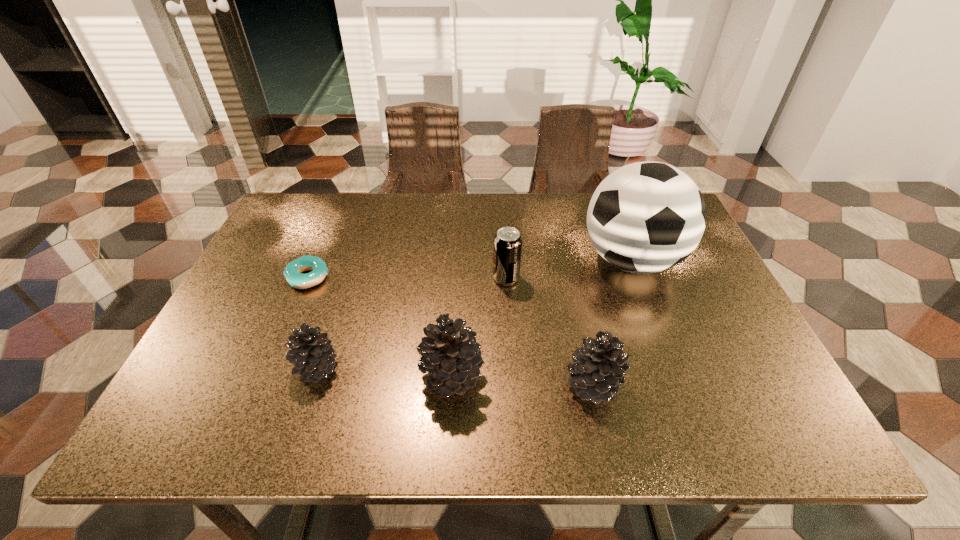
Where is `the leftmost pinecone`? The width and height of the screenshot is (960, 540). the leftmost pinecone is located at coordinates (312, 352).

Identify the location of the shortest pinecone. The image size is (960, 540). (312, 352).

Locate an element on the screen. The image size is (960, 540). the fourth object from right to left is located at coordinates (450, 353).

The image size is (960, 540). In order to click on the rightmost pinecone in this screenshot , I will do `click(598, 373)`.

This screenshot has height=540, width=960. What are the coordinates of `the tallest object` in the screenshot? It's located at (646, 217).

Identify the location of doughnut. (292, 272).

The height and width of the screenshot is (540, 960). What are the coordinates of `soda can` in the screenshot? It's located at (507, 248).

Where is `vacant space positioned 0.220m on the back of the fifth tallest object`? vacant space positioned 0.220m on the back of the fifth tallest object is located at coordinates (345, 282).

Where is `vacant space situated 0.260m on the right of the third object from left to right`? vacant space situated 0.260m on the right of the third object from left to right is located at coordinates (608, 376).

The width and height of the screenshot is (960, 540). Find the location of `vacant region located on the left of the second tallest pinecone`. vacant region located on the left of the second tallest pinecone is located at coordinates (390, 384).